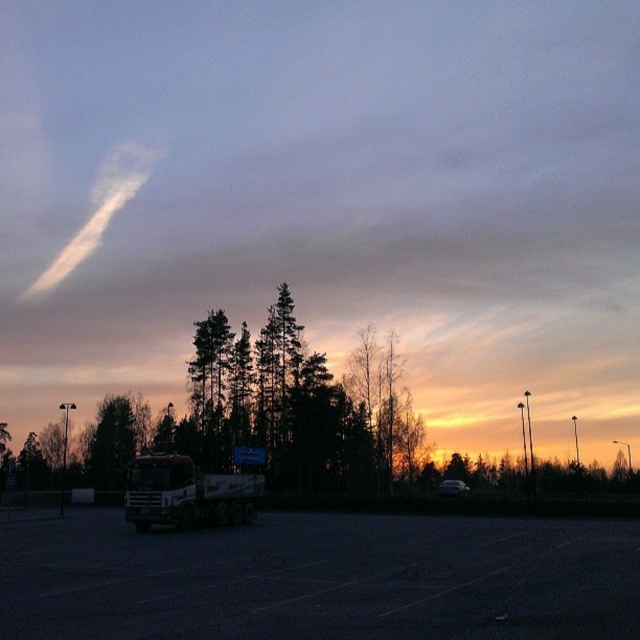
Between point (193, 524) and point (444, 486), which one is positioned behind?

The point (444, 486) is behind.

Is white matte truck at center to the right of matte white truck at lower center from the viewer's perspective?

Incorrect, white matte truck at center is not on the right side of matte white truck at lower center.

Locate an element on the screen. This screenshot has height=640, width=640. white matte truck at center is located at coordinates (188, 493).

At what (x,y) coordinates should I click in order to perform the action: click on white matte truck at center. Please return your answer as a coordinate pair (x, y). This screenshot has height=640, width=640. Looking at the image, I should click on (188, 493).

Can you confirm if black asphalt parking lot at center is positioned below matte white truck at lower center?

Incorrect, black asphalt parking lot at center is not positioned below matte white truck at lower center.

This screenshot has height=640, width=640. What do you see at coordinates (321, 579) in the screenshot?
I see `black asphalt parking lot at center` at bounding box center [321, 579].

Find the location of a particular element. The width and height of the screenshot is (640, 640). black asphalt parking lot at center is located at coordinates (321, 579).

Can you confirm if black asphalt parking lot at center is taller than white matte truck at center?

Indeed, black asphalt parking lot at center has a greater height compared to white matte truck at center.

Does black asphalt parking lot at center appear on the right side of white matte truck at center?

Indeed, black asphalt parking lot at center is positioned on the right side of white matte truck at center.

Who is more forward, [332,595] or [189,497]?

Positioned in front is point [332,595].

This screenshot has height=640, width=640. I want to click on black asphalt parking lot at center, so click(321, 579).